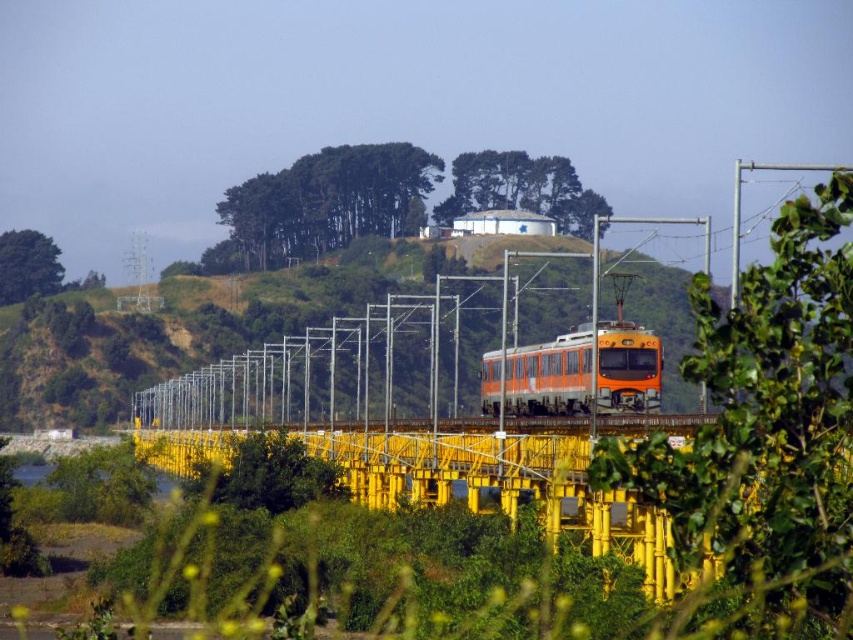
You are a passenger on the orange matte train at center. As the train moves towards you, can you see the hill covered with dense green foliage in the background through the window?

The orange matte train at center is located at point (540, 376), so the train is positioned centrally in the frame moving towards the viewer. Since the hill is in the background behind the train, it would be visible through the window as the train moves forward.

You are standing on the yellow bridge and looking towards the train. Which direction should you turn to face the green grassy hillside at center represented by point (195, 324)?

The green grassy hillside at center is located at point (195, 324), which is directly in front of you since it is at the center. Therefore, you should turn to face forward to see it.